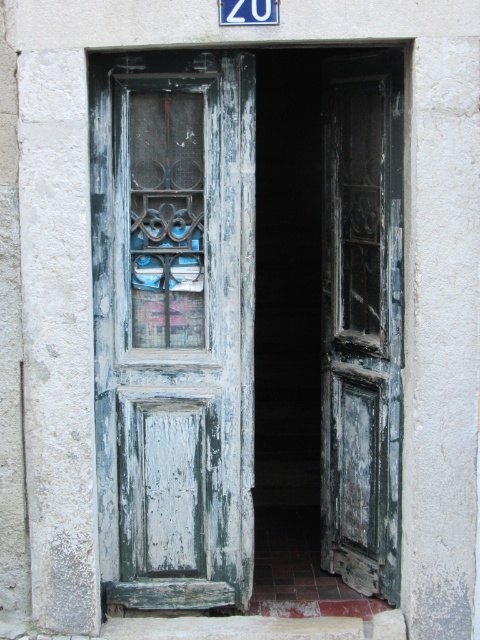
You are standing in front of the distressed green wood door at center and the white plastic sign at upper center. Which object is positioned to the left?

The white plastic sign at upper center is positioned to the left of the distressed green wood door at center.

You are standing in front of the weathered teal wood door at center and the distressed green wood door at center. Which door is located higher up?

The weathered teal wood door at center is positioned under the distressed green wood door at center, so the distressed green wood door at center is higher up.

You are standing in front of two doors. One is the weathered teal wood door at center and the other is the distressed green wood door at center. Which door is more to the left?

The weathered teal wood door at center is positioned on the left side of the distressed green wood door at center, so the weathered teal wood door at center is more to the left.